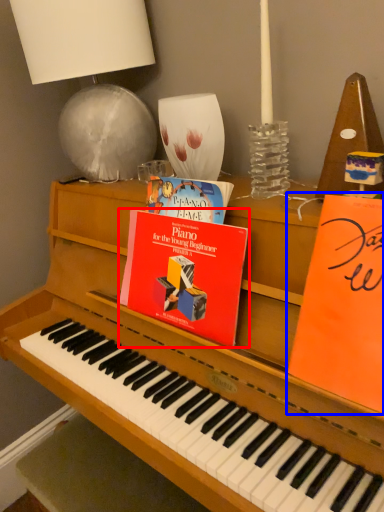
Question: Among these objects, which one is nearest to the camera, paperback book (highlighted by a red box) or paperback book (highlighted by a blue box)?

Choices:
 (A) paperback book
 (B) paperback book

Answer: (B)